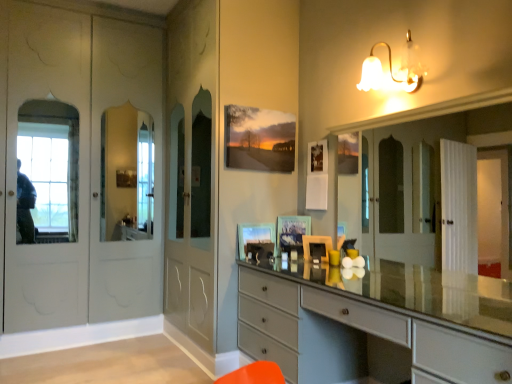
Question: Looking at the image, does matte glass picture frame at center, marked as the 2th picture frame in a left-to-right arrangement, seem bigger or smaller compared to white glass bell-shaped light fixture at upper right?

Choices:
 (A) small
 (B) big

Answer: (A)

Question: From a real-world perspective, is matte glass picture frame at center, marked as the 2th picture frame in a left-to-right arrangement, above or below white glass bell-shaped light fixture at upper right?

Choices:
 (A) below
 (B) above

Answer: (A)

Question: Which object is the closest to the matte glass picture frame at center, which is the 2th picture frame from right to left?

Choices:
 (A) matte glass picture frame at center, marked as the 2th picture frame in a left-to-right arrangement
 (B) matte gray chest of drawers at center
 (C) white glass bell-shaped light fixture at upper right

Answer: (A)

Question: Estimate the real-world distances between objects in this image. Which object is farther from the matte gray chest of drawers at center?

Choices:
 (A) matte glass picture frame at center, which is counted as the first picture frame, starting from the right
 (B) matte glass picture frame at center, the 1th picture frame from the left
 (C) white glass bell-shaped light fixture at upper right

Answer: (C)